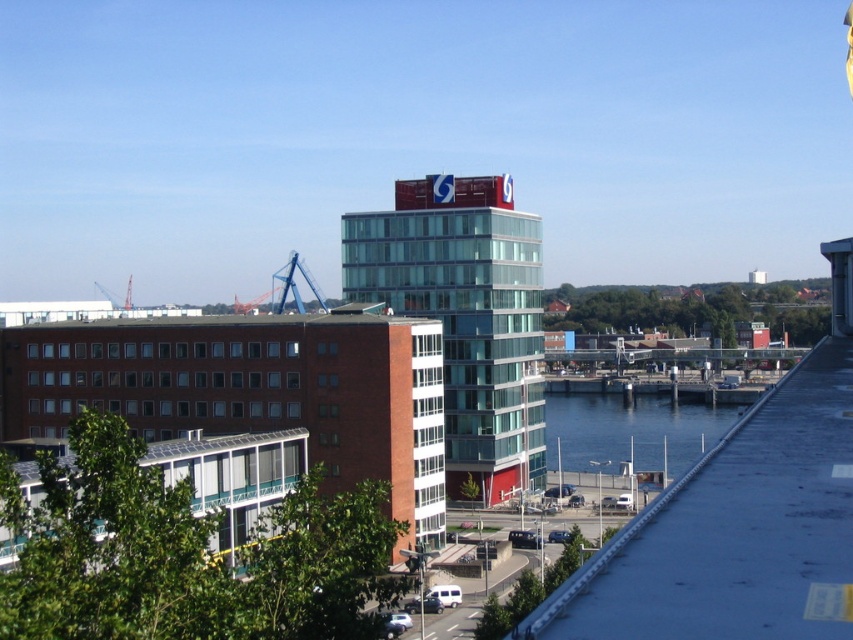
Question: Considering the relative positions of glassy blue building at center and blue water at lower center in the image provided, where is glassy blue building at center located with respect to blue water at lower center?

Choices:
 (A) below
 (B) above

Answer: (B)

Question: Can you confirm if glassy blue building at center is smaller than blue water at lower center?

Choices:
 (A) yes
 (B) no

Answer: (A)

Question: Is glassy blue building at center below blue water at lower center?

Choices:
 (A) no
 (B) yes

Answer: (A)

Question: Among these objects, which one is nearest to the camera?

Choices:
 (A) glassy blue building at center
 (B) blue water at lower center

Answer: (A)